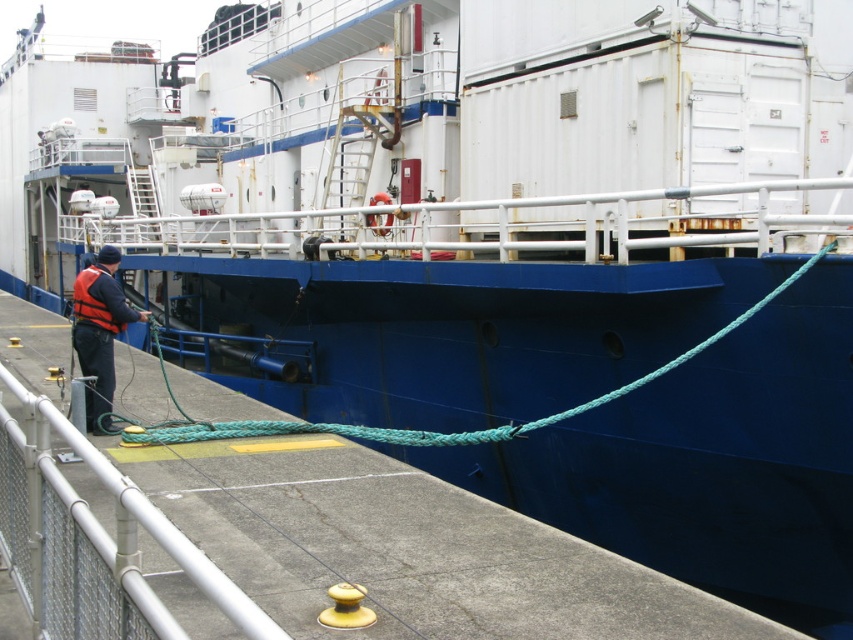
Is green rope at lower left behind matte orange life vest at left?

No, it is in front of matte orange life vest at left.

Does green rope at lower left appear under matte orange life vest at left?

Correct, green rope at lower left is located below matte orange life vest at left.

Image resolution: width=853 pixels, height=640 pixels. What do you see at coordinates (430, 429) in the screenshot?
I see `green rope at lower left` at bounding box center [430, 429].

Where is `green rope at lower left`? The width and height of the screenshot is (853, 640). green rope at lower left is located at coordinates (430, 429).